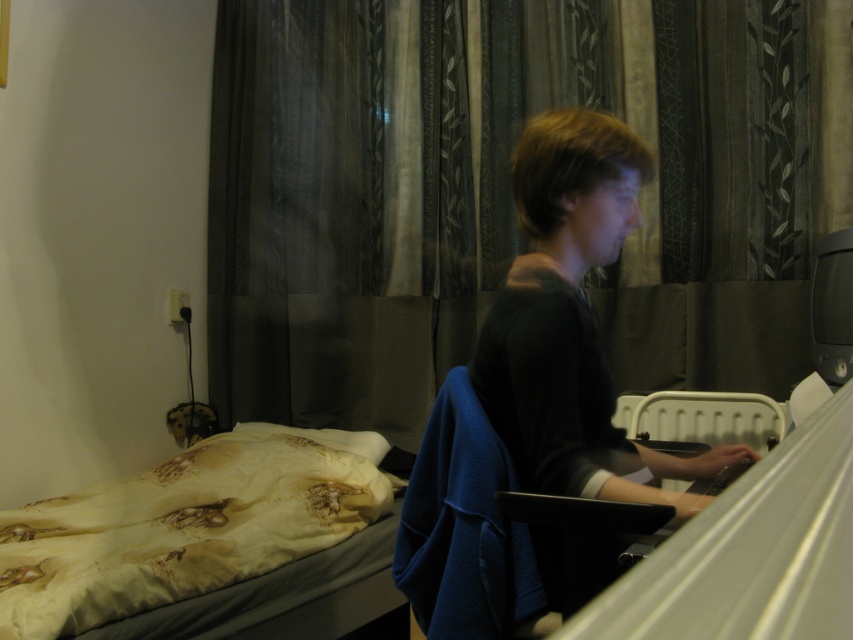
You are a guest in this room and want to know which object is larger between the dark gray sheer curtain at center and the printed fabric bed at lower left. Can you tell me which one is bigger?

The dark gray sheer curtain at center is bigger than the printed fabric bed at lower left.

You are trying to decide whether to place a new lamp on the printed fabric bed at lower left or the dark gray sweater at center. Based on their heights, which surface would be more stable for the lamp?

The printed fabric bed at lower left has a lesser height compared to the dark gray sweater at center, so the dark gray sweater at center is taller and would provide a more stable surface for the lamp.